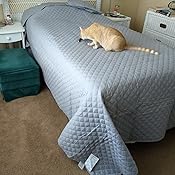
Locate an element on the screen. end tables is located at coordinates (129, 19), (7, 36).